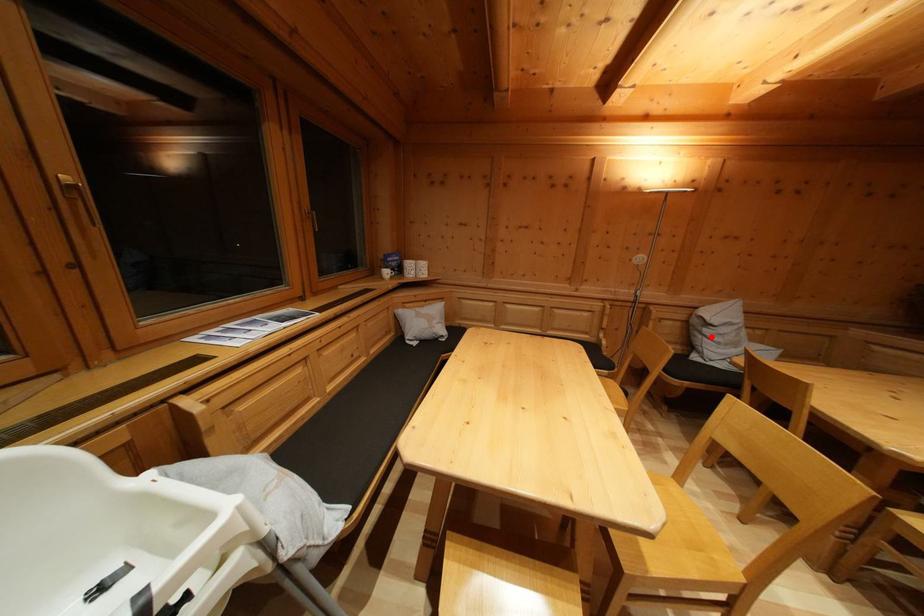
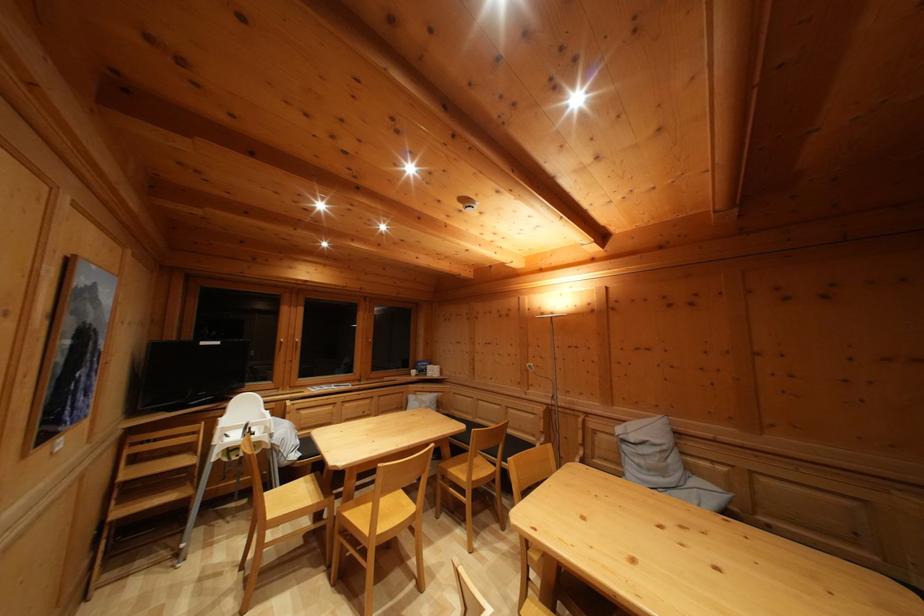
Locate, in the second image, the point that corresponds to the highlighted location in the first image.

(629, 454)